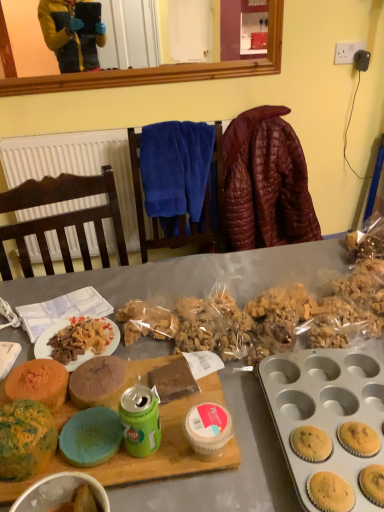
Question: Should I look upward or downward to see speckled green cake at center left, arranged as the second snack when viewed from the back?

Choices:
 (A) down
 (B) up

Answer: (A)

Question: Is white textured radiator at upper left located outside leather jacket at upper right?

Choices:
 (A) no
 (B) yes

Answer: (B)

Question: From the image's perspective, is white textured radiator at upper left on leather jacket at upper right?

Choices:
 (A) no
 (B) yes

Answer: (A)

Question: Is white textured radiator at upper left wider than leather jacket at upper right?

Choices:
 (A) no
 (B) yes

Answer: (A)

Question: From the image's perspective, is white textured radiator at upper left under leather jacket at upper right?

Choices:
 (A) yes
 (B) no

Answer: (A)

Question: Are white textured radiator at upper left and leather jacket at upper right located far from each other?

Choices:
 (A) yes
 (B) no

Answer: (B)

Question: Is white textured radiator at upper left smaller than leather jacket at upper right?

Choices:
 (A) no
 (B) yes

Answer: (B)

Question: Does speckled green cake at center left, arranged as the second snack when viewed from the back, come in front of white textured radiator at upper left?

Choices:
 (A) yes
 (B) no

Answer: (A)

Question: From a real-world perspective, is speckled green cake at center left, which ranks as the first snack in front-to-back order, physically above white textured radiator at upper left?

Choices:
 (A) yes
 (B) no

Answer: (A)

Question: Is speckled green cake at center left, which ranks as the first snack in front-to-back order, further to camera compared to white textured radiator at upper left?

Choices:
 (A) no
 (B) yes

Answer: (A)

Question: Is speckled green cake at center left, which ranks as the first snack in front-to-back order, wider than white textured radiator at upper left?

Choices:
 (A) no
 (B) yes

Answer: (B)

Question: Can you confirm if speckled green cake at center left, arranged as the second snack when viewed from the back, is thinner than white textured radiator at upper left?

Choices:
 (A) no
 (B) yes

Answer: (A)

Question: Is speckled green cake at center left, arranged as the second snack when viewed from the back, next to white textured radiator at upper left?

Choices:
 (A) no
 (B) yes

Answer: (A)

Question: Is multicolored sponge cake at center left, the 1th snack when ordered from back to front, far away from white textured radiator at upper left?

Choices:
 (A) no
 (B) yes

Answer: (B)